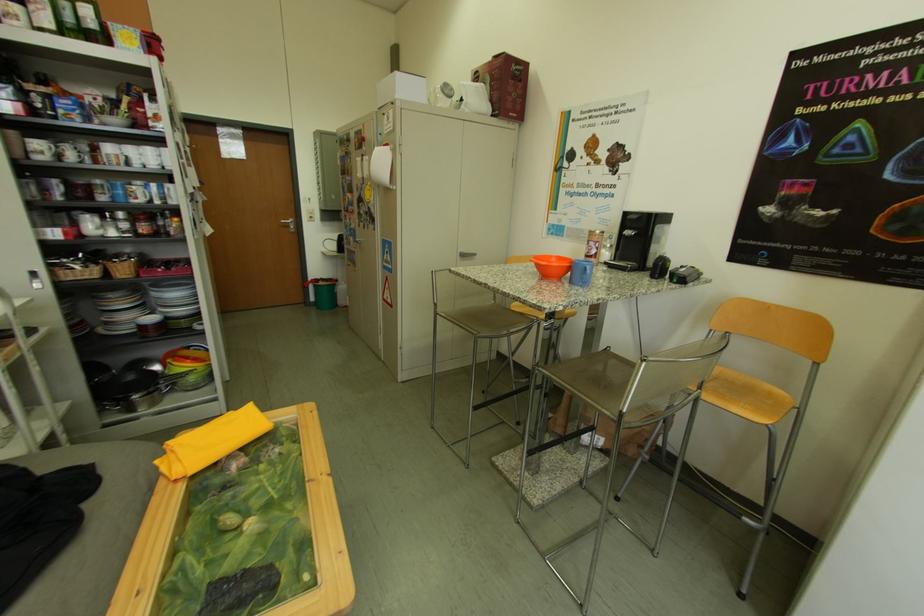
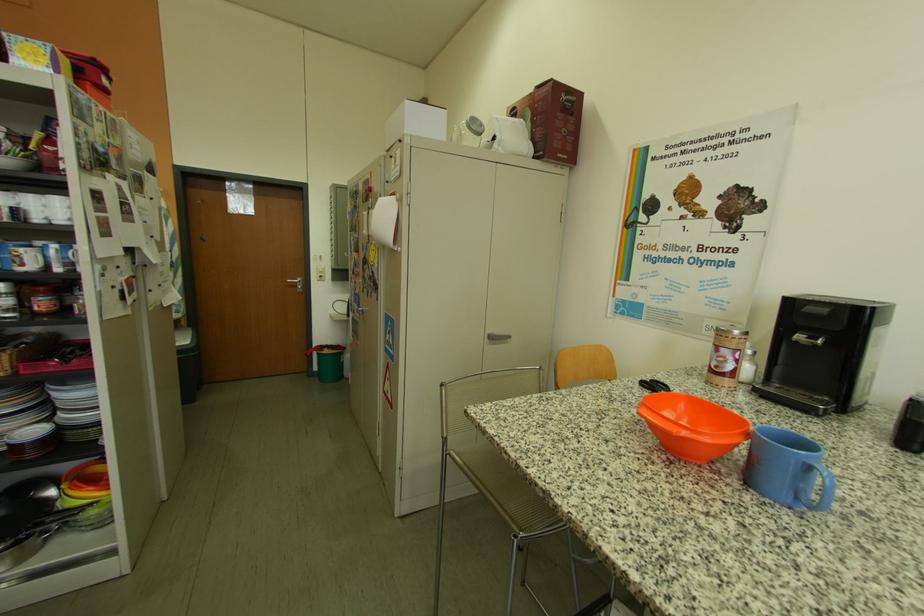
Where in the second image is the point corresponding to pixel 565 262 from the first image?

(695, 408)